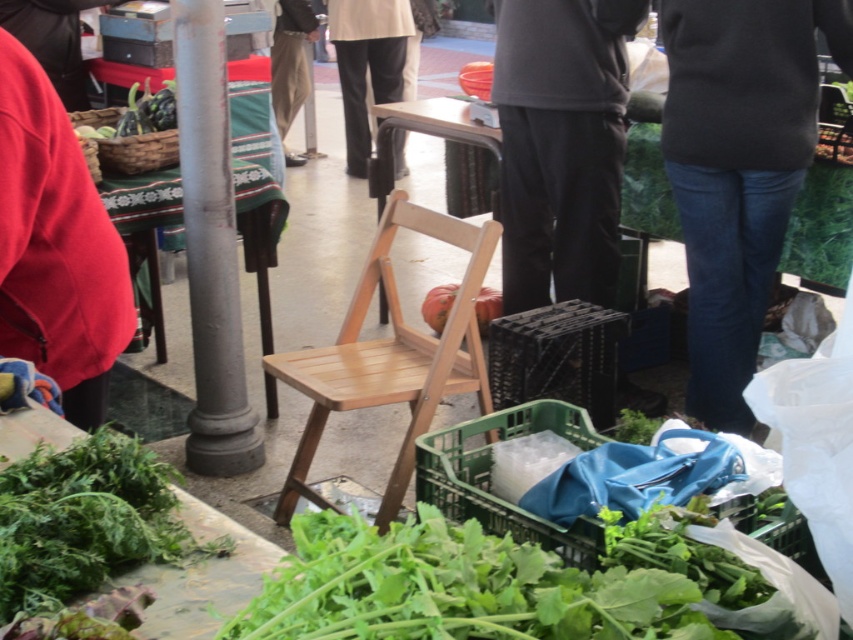
Question: Can you confirm if green leafy vegetable at upper left is bigger than smooth orange pumpkin at center?

Choices:
 (A) yes
 (B) no

Answer: (A)

Question: Estimate the real-world distances between objects in this image. Which object is farther from the green leafy vegetable at upper left?

Choices:
 (A) red fleece jacket at left
 (B) green leafy at lower left
 (C) red fabric jacket at upper left
 (D) dark gray sweater at upper right

Answer: (B)

Question: Where is dark gray hoodie at center located in relation to dark gray pants at center in the image?

Choices:
 (A) below
 (B) above

Answer: (A)

Question: Can you confirm if green leafy at lower center is positioned to the right of smooth orange pumpkin at center?

Choices:
 (A) no
 (B) yes

Answer: (A)

Question: Which of the following is the closest to the observer?

Choices:
 (A) red fabric jacket at upper left
 (B) green leafy vegetable at upper left
 (C) dark gray pants at center
 (D) smooth orange pumpkin at center

Answer: (B)

Question: Which object appears farthest from the camera in this image?

Choices:
 (A) red fleece jacket at left
 (B) red fabric jacket at upper left
 (C) green leafy at lower center

Answer: (B)